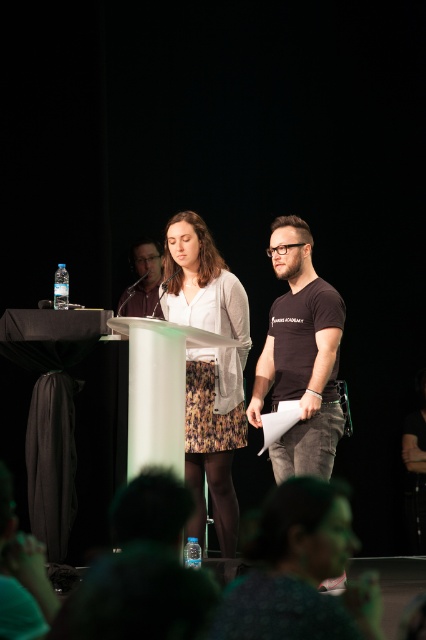
Question: Is green textured shirt at lower center below printed fabric skirt at center?

Choices:
 (A) no
 (B) yes

Answer: (B)

Question: Which object appears farthest from the camera in this image?

Choices:
 (A) printed fabric skirt at center
 (B) green textured shirt at lower center

Answer: (A)

Question: Can you confirm if green textured shirt at lower center is wider than matte black microphone at center?

Choices:
 (A) yes
 (B) no

Answer: (A)

Question: Considering the real-world distances, which object is farthest from the black matte t-shirt at center?

Choices:
 (A) printed fabric skirt at center
 (B) green textured shirt at lower center

Answer: (B)

Question: In this image, where is green textured shirt at lower center located relative to printed fabric skirt at center?

Choices:
 (A) below
 (B) above

Answer: (A)

Question: Which is nearer to the printed fabric skirt at center?

Choices:
 (A) matte black microphone at center
 (B) black matte t-shirt at center

Answer: (B)